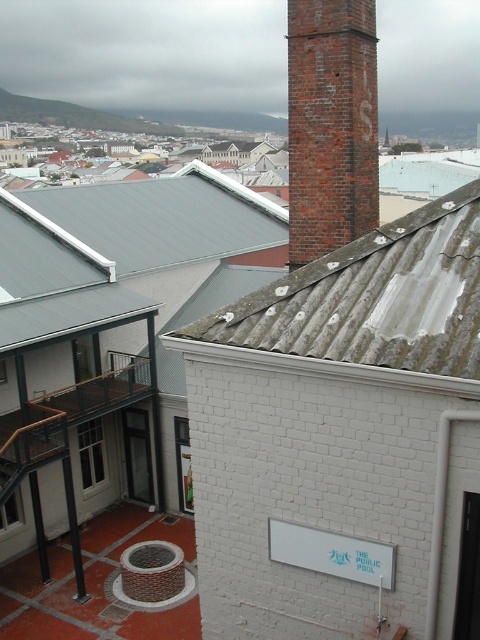
Question: Based on their relative distances, which object is nearer to the brick chimney at upper center?

Choices:
 (A) metallic gray roof at upper left
 (B) weathered metal roof at center

Answer: (B)

Question: Can you confirm if weathered metal roof at center is thinner than brick chimney at upper center?

Choices:
 (A) yes
 (B) no

Answer: (A)

Question: Which point is closer to the camera taking this photo?

Choices:
 (A) [110, 257]
 (B) [317, 164]
 (C) [222, 346]

Answer: (C)

Question: Is weathered metal roof at center in front of metallic gray roof at upper left?

Choices:
 (A) no
 (B) yes

Answer: (B)

Question: Estimate the real-world distances between objects in this image. Which object is closer to the metallic gray roof at upper left?

Choices:
 (A) weathered metal roof at center
 (B) brick chimney at upper center

Answer: (B)

Question: Is weathered metal roof at center bigger than metallic gray roof at upper left?

Choices:
 (A) no
 (B) yes

Answer: (A)